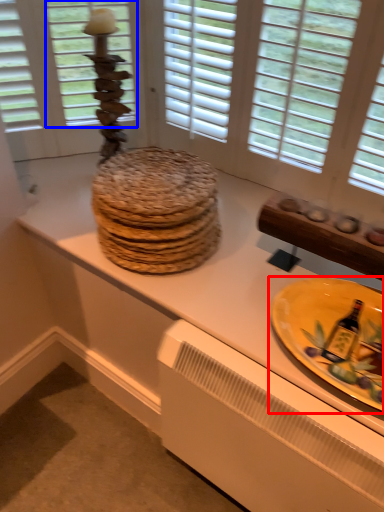
Question: Which of the following is the farthest to the observer, plate (highlighted by a red box) or window screen (highlighted by a blue box)?

Choices:
 (A) plate
 (B) window screen

Answer: (B)